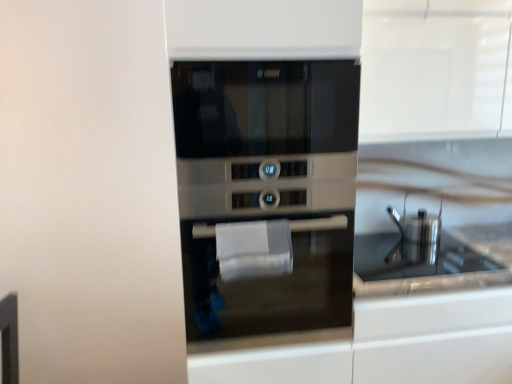
Question: Is satin silver oven at center thinner than satin silver oven at center?

Choices:
 (A) yes
 (B) no

Answer: (A)

Question: Considering the relative positions of satin silver oven at center and satin silver oven at center in the image provided, is satin silver oven at center to the left of satin silver oven at center from the viewer's perspective?

Choices:
 (A) no
 (B) yes

Answer: (A)

Question: Can you confirm if satin silver oven at center is wider than satin silver oven at center?

Choices:
 (A) no
 (B) yes

Answer: (A)

Question: Is satin silver oven at center outside satin silver oven at center?

Choices:
 (A) yes
 (B) no

Answer: (A)

Question: Considering the relative sizes of satin silver oven at center and satin silver oven at center in the image provided, is satin silver oven at center bigger than satin silver oven at center?

Choices:
 (A) no
 (B) yes

Answer: (A)

Question: In the image, is satin silver oven at center positioned in front of or behind glossy stainless steel sink at center?

Choices:
 (A) behind
 (B) front

Answer: (A)

Question: In terms of height, does satin silver oven at center look taller or shorter compared to glossy stainless steel sink at center?

Choices:
 (A) short
 (B) tall

Answer: (B)

Question: Looking at their shapes, would you say satin silver oven at center is wider or thinner than glossy stainless steel sink at center?

Choices:
 (A) wide
 (B) thin

Answer: (B)

Question: Would you say satin silver oven at center is to the left or to the right of glossy stainless steel sink at center in the picture?

Choices:
 (A) right
 (B) left

Answer: (A)

Question: From the image's perspective, relative to glossy stainless steel sink at center, is white textured hand towel at center above or below?

Choices:
 (A) above
 (B) below

Answer: (A)

Question: Considering the positions of white textured hand towel at center and glossy stainless steel sink at center in the image, is white textured hand towel at center taller or shorter than glossy stainless steel sink at center?

Choices:
 (A) short
 (B) tall

Answer: (B)

Question: Considering the relative positions of white textured hand towel at center and glossy stainless steel sink at center in the image provided, is white textured hand towel at center to the left or to the right of glossy stainless steel sink at center?

Choices:
 (A) left
 (B) right

Answer: (A)

Question: Is point (228, 273) positioned closer to the camera than point (473, 226)?

Choices:
 (A) closer
 (B) farther

Answer: (A)

Question: Is glossy stainless steel sink at center taller or shorter than satin silver oven at center?

Choices:
 (A) tall
 (B) short

Answer: (B)

Question: Considering the relative positions of glossy stainless steel sink at center and satin silver oven at center in the image provided, is glossy stainless steel sink at center to the left or to the right of satin silver oven at center?

Choices:
 (A) right
 (B) left

Answer: (A)